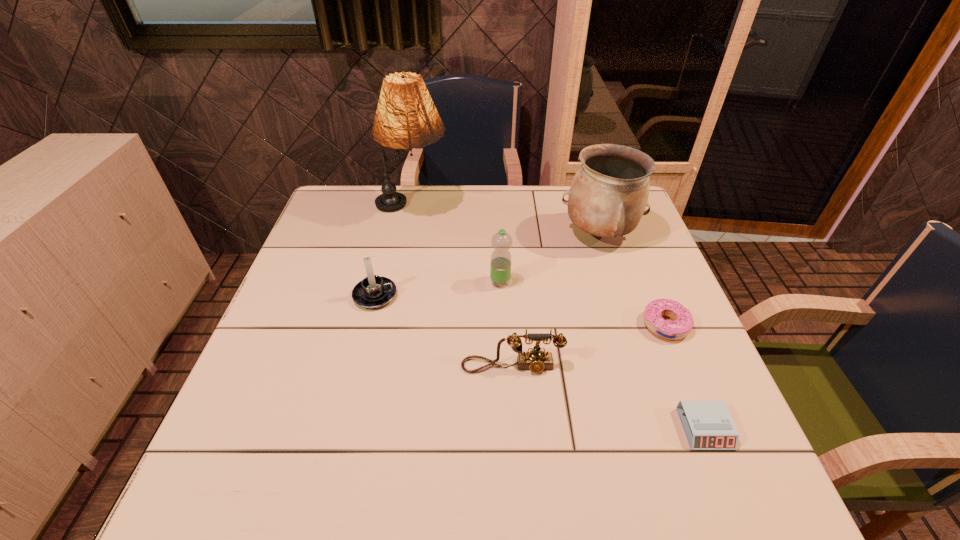
Identify the location of free space that satisfies the following two spatial constraints: 1. on the front-facing side of the water bottle; 2. on the left side of the tallest object. This screenshot has width=960, height=540. (397, 282).

Find the location of a particular element. The image size is (960, 540). free spot that satisfies the following two spatial constraints: 1. with a handle on the side of the sixth tallest object; 2. on the right side of the candle holder is located at coordinates pos(368,325).

At what (x,y) coordinates should I click in order to perform the action: click on vacant position in the image that satisfies the following two spatial constraints: 1. on the front-facing side of the tallest object; 2. on the left side of the nearest object. Please return your answer as a coordinate pair (x, y). Image resolution: width=960 pixels, height=540 pixels. Looking at the image, I should click on (369, 429).

Image resolution: width=960 pixels, height=540 pixels. Identify the location of free space that satisfies the following two spatial constraints: 1. on the front-facing side of the telephone; 2. on the right side of the nearest object. (516, 429).

The image size is (960, 540). What are the coordinates of `free location that satisfies the following two spatial constraints: 1. on the back side of the doughnut; 2. with a handle on the side of the candle holder` in the screenshot? It's located at (653, 295).

This screenshot has width=960, height=540. Find the location of `free space that satisfies the following two spatial constraints: 1. on the front-facing side of the lampshade; 2. on the back side of the urn`. free space that satisfies the following two spatial constraints: 1. on the front-facing side of the lampshade; 2. on the back side of the urn is located at coordinates (407, 234).

Locate an element on the screen. Image resolution: width=960 pixels, height=540 pixels. vacant space that satisfies the following two spatial constraints: 1. with a handle on the side of the shortest object; 2. on the left side of the candle holder is located at coordinates (343, 429).